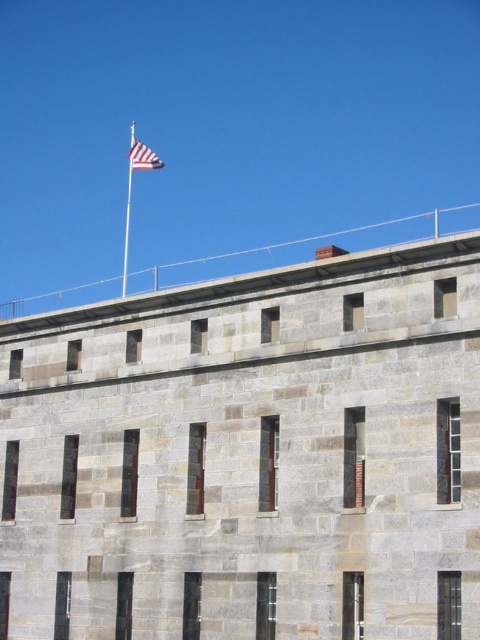
Question: Among these points, which one is nearest to the camera?

Choices:
 (A) (137, 156)
 (B) (131, 129)

Answer: (A)

Question: Is polished metal flag pole at upper center closer to camera compared to striped fabric flag at upper center?

Choices:
 (A) yes
 (B) no

Answer: (B)

Question: Is polished metal flag pole at upper center closer to camera compared to striped fabric flag at upper center?

Choices:
 (A) no
 (B) yes

Answer: (A)

Question: Can you confirm if polished metal flag pole at upper center is positioned above striped fabric flag at upper center?

Choices:
 (A) no
 (B) yes

Answer: (B)

Question: Which point is farther from the camera taking this photo?

Choices:
 (A) (132, 163)
 (B) (130, 195)

Answer: (B)